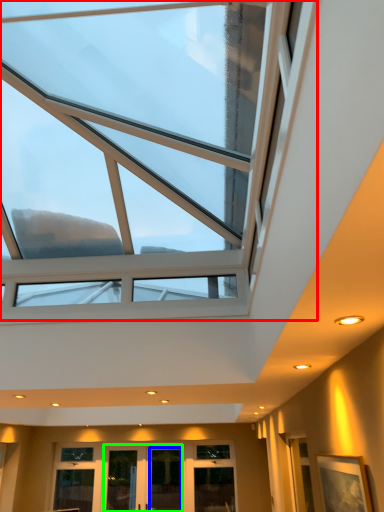
Question: Considering the real-world distances, which object is farthest from window (highlighted by a red box)? glass door (highlighted by a blue box) or glass door (highlighted by a green box)?

Choices:
 (A) glass door
 (B) glass door

Answer: (A)